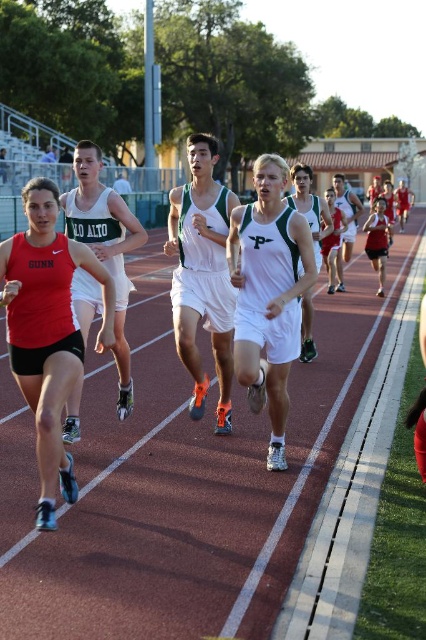
Between white matte shorts at center and matte red tank top at center, which one is positioned lower?

white matte shorts at center

Between white matte shorts at center and matte red tank top at center, which one has more height?

white matte shorts at center is taller.

Find the location of a particular element. Image resolution: width=426 pixels, height=640 pixels. white matte shorts at center is located at coordinates (268, 294).

Does point (229, 396) come farther from viewer compared to point (66, 410)?

Yes, it is behind point (66, 410).

Image resolution: width=426 pixels, height=640 pixels. What do you see at coordinates (203, 273) in the screenshot?
I see `white matte tank top at center` at bounding box center [203, 273].

The image size is (426, 640). Find the location of `white matte tank top at center`. white matte tank top at center is located at coordinates (203, 273).

Find the location of a particular element. The height and width of the screenshot is (640, 426). white matte shorts at center is located at coordinates (268, 294).

Which is more to the left, white matte shorts at center or white/green athletic uniform at center?

From the viewer's perspective, white matte shorts at center appears more on the left side.

What do you see at coordinates (268, 294) in the screenshot?
I see `white matte shorts at center` at bounding box center [268, 294].

You are a GUI agent. You are given a task and a screenshot of the screen. Output one action in this format:
    pyautogui.click(x=<x>, y=<y>)
    Task: Click on the white matte shorts at center
    
    Given the screenshot: What is the action you would take?
    (268, 294)